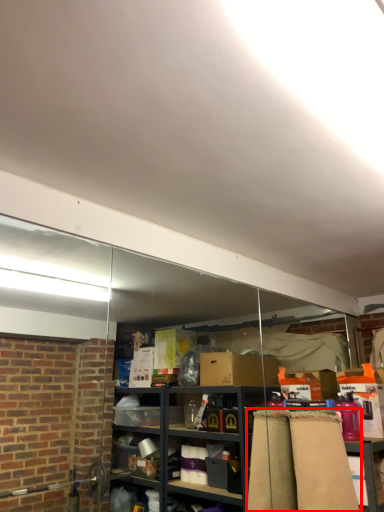
Question: From the image's perspective, where is curtain (annotated by the red box) located relative to table?

Choices:
 (A) above
 (B) below

Answer: (A)